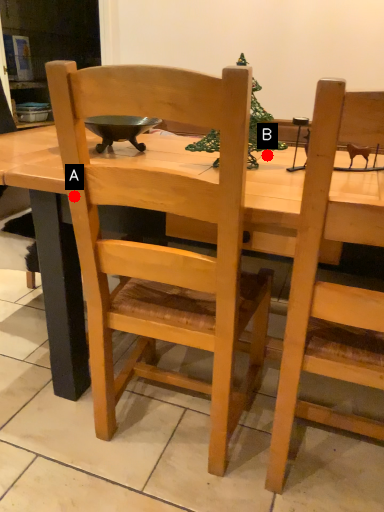
Question: Two points are circled on the image, labeled by A and B beside each circle. Which point is farther from the camera taking this photo?

Choices:
 (A) A is further
 (B) B is further

Answer: (B)